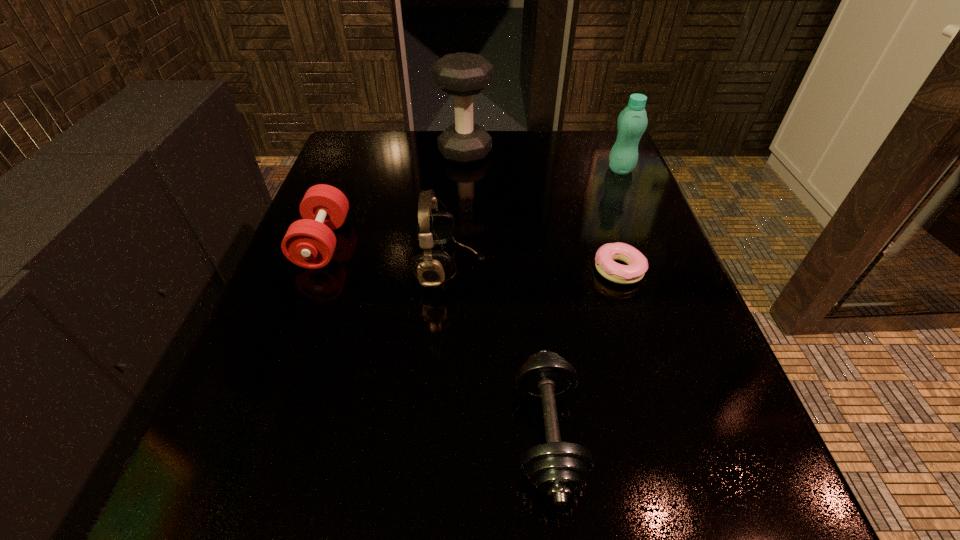
At what (x,y) coordinates should I click in order to perform the action: click on free space located 0.150m on the left of the second dumbbell from left to right. Please return your answer as a coordinate pair (x, y). Looking at the image, I should click on 380,153.

You are a GUI agent. You are given a task and a screenshot of the screen. Output one action in this format:
    pyautogui.click(x=<x>, y=<y>)
    Task: Click on the vacant space located on the front of the rightmost object
    
    Given the screenshot: What is the action you would take?
    pyautogui.click(x=633, y=198)

At what (x,y) coordinates should I click in order to perform the action: click on vacant region located 0.080m with the microphone on the side of the headset. Please return your answer as a coordinate pair (x, y). Looking at the image, I should click on (528, 267).

Identify the location of free region located 0.380m on the front of the leftmost dumbbell. (232, 478).

The width and height of the screenshot is (960, 540). What are the coordinates of `vacant space situated on the left of the nearest dumbbell` in the screenshot? It's located at (305, 434).

Where is `free point located on the left of the doughnut`? The height and width of the screenshot is (540, 960). free point located on the left of the doughnut is located at coordinates (536, 270).

This screenshot has height=540, width=960. I want to click on dumbbell situated at the far edge, so click(463, 75).

At what (x,y) coordinates should I click in order to perform the action: click on bottle that is at the far edge. Please return your answer as a coordinate pair (x, y). The image size is (960, 540). Looking at the image, I should click on (632, 122).

This screenshot has width=960, height=540. What are the coordinates of `object present at the near edge` in the screenshot? It's located at (557, 469).

You are a GUI agent. You are given a task and a screenshot of the screen. Output one action in this format:
    pyautogui.click(x=<x>, y=<y>)
    Task: Click on the object situated at the left edge
    
    Given the screenshot: What is the action you would take?
    pyautogui.click(x=310, y=242)